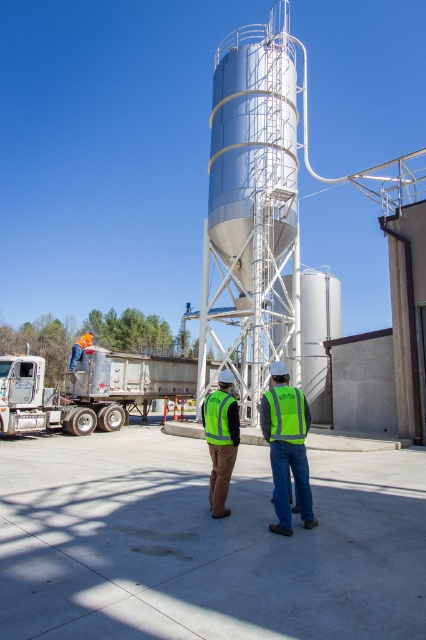
In the scene shown: You are a delivery driver who just arrived at the industrial site. You need to locate the green reflective vest at center to hand over the delivery. According to the coordinates provided, where exactly should you look to find it?

The green reflective vest at center is located at point [221,440].

You are a safety inspector evaluating the scene. You notice the green reflective safety vest at center and the orange hard hat at lower left. Which object has a smaller width when viewed from your perspective?

The green reflective safety vest at center is thinner than the orange hard hat at lower left, so the green reflective safety vest at center has a smaller width.

You are a safety inspector standing at the camera position. You need to reach the green reflective safety vest at center to check its compliance with safety standards. Can you walk directly to it without any obstacles?

The green reflective safety vest at center is 20.85 feet away from the camera. Since there are no mentioned obstacles in the scene description, you can walk directly to it.